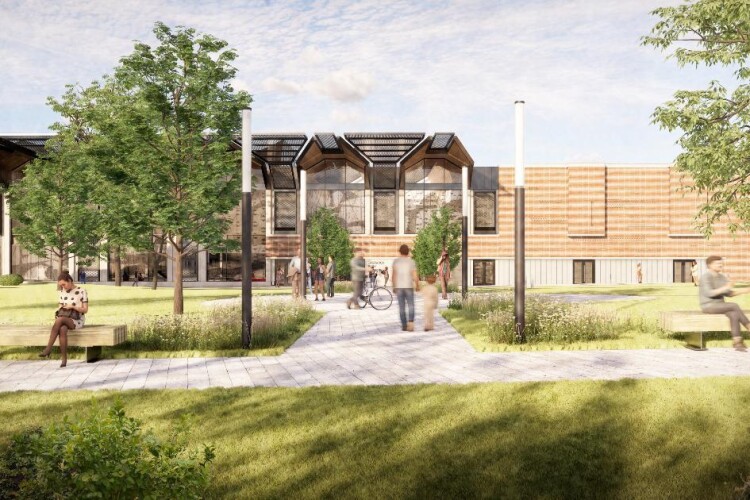
The height and width of the screenshot is (500, 750). In order to click on bench in this screenshot , I will do tap(691, 318), tap(102, 329).